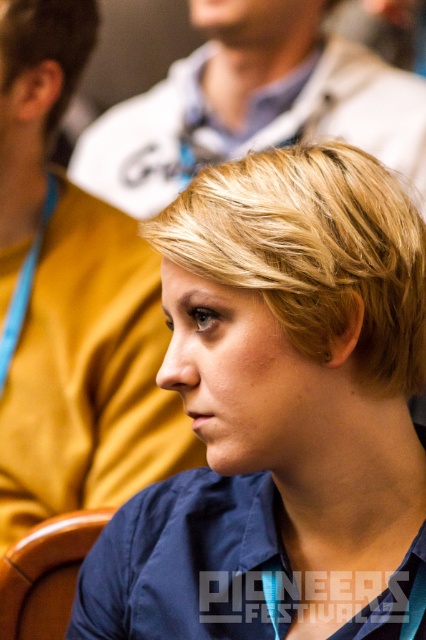
Question: Considering the real-world distances, which object is farthest from the blonde hair at upper left?

Choices:
 (A) blondehair at center
 (B) brown leather chair at lower left
 (C) blue fabric shirt at center

Answer: (B)

Question: Is blondehair at center wider than brown leather chair at lower left?

Choices:
 (A) no
 (B) yes

Answer: (B)

Question: Does blue fabric shirt at center have a lesser width compared to brown leather chair at lower left?

Choices:
 (A) yes
 (B) no

Answer: (B)

Question: Estimate the real-world distances between objects in this image. Which object is closer to the blonde hair at upper left?

Choices:
 (A) brown leather chair at lower left
 (B) blondehair at center

Answer: (B)

Question: Among these objects, which one is farthest from the camera?

Choices:
 (A) blondehair at center
 (B) blonde hair at upper left
 (C) blue fabric shirt at center
 (D) brown leather chair at lower left

Answer: (B)

Question: Is blue fabric shirt at center to the right of blondehair at center from the viewer's perspective?

Choices:
 (A) no
 (B) yes

Answer: (A)